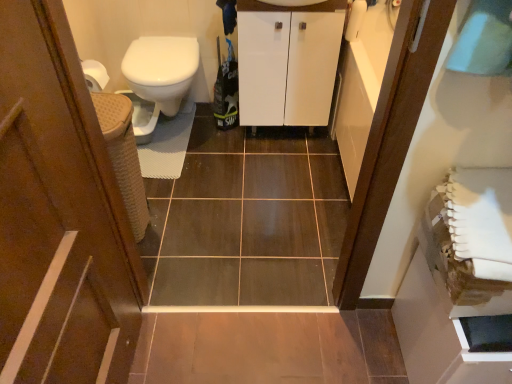
Question: Is white glossy cabinet at center completely or partially outside of white glossy bidet at left?

Choices:
 (A) yes
 (B) no

Answer: (A)

Question: Would you say white glossy cabinet at center contains white glossy bidet at left?

Choices:
 (A) no
 (B) yes

Answer: (A)

Question: Would you consider white glossy cabinet at center to be distant from white glossy bidet at left?

Choices:
 (A) no
 (B) yes

Answer: (A)

Question: Is white glossy cabinet at center further to the viewer compared to white glossy bidet at left?

Choices:
 (A) no
 (B) yes

Answer: (A)

Question: From the image's perspective, is white glossy cabinet at center located beneath white glossy bidet at left?

Choices:
 (A) yes
 (B) no

Answer: (B)

Question: From the image's perspective, is white glossy bidet at left located above or below brown wood door at left?

Choices:
 (A) above
 (B) below

Answer: (A)

Question: In terms of size, does white glossy bidet at left appear bigger or smaller than brown wood door at left?

Choices:
 (A) big
 (B) small

Answer: (B)

Question: Visually, is white glossy bidet at left positioned to the left or to the right of brown wood door at left?

Choices:
 (A) right
 (B) left

Answer: (B)

Question: Is white glossy bidet at left situated inside brown wood door at left or outside?

Choices:
 (A) outside
 (B) inside

Answer: (A)

Question: From a real-world perspective, is brown wood door at left physically located above or below white glossy bidet at left?

Choices:
 (A) above
 (B) below

Answer: (A)

Question: In terms of height, does brown wood door at left look taller or shorter compared to white glossy bidet at left?

Choices:
 (A) short
 (B) tall

Answer: (B)

Question: Is point (93, 243) positioned closer to the camera than point (140, 39)?

Choices:
 (A) farther
 (B) closer

Answer: (B)

Question: Based on their positions, is brown wood door at left located to the left or right of white glossy bidet at left?

Choices:
 (A) left
 (B) right

Answer: (B)

Question: Is white glossy bidet at left taller or shorter than white glossy cabinet at center?

Choices:
 (A) tall
 (B) short

Answer: (B)

Question: From a real-world perspective, is white glossy bidet at left above or below white glossy cabinet at center?

Choices:
 (A) below
 (B) above

Answer: (A)